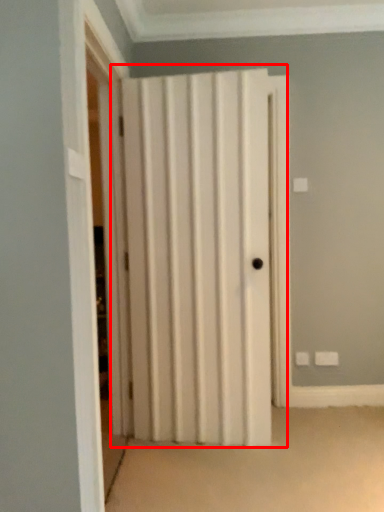
Question: In this image, where is door (annotated by the red box) located relative to screen door?

Choices:
 (A) right
 (B) left

Answer: (A)